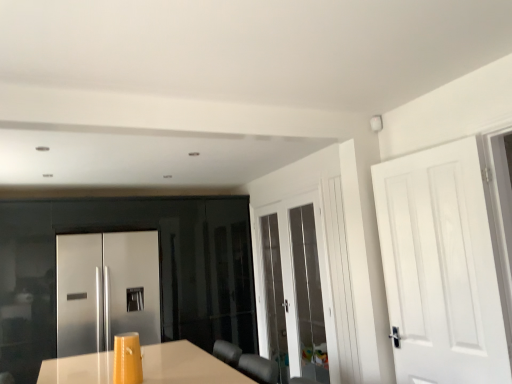
Question: Which is correct: white matte door at right, which is the third door from back to front, is inside satin stainless steel refrigerator at center, placed as the first door when sorted from back to front, or outside of it?

Choices:
 (A) inside
 (B) outside

Answer: (B)

Question: From the image's perspective, is white matte door at right, which is counted as the first door, starting from the right, located above or below satin stainless steel refrigerator at center, placed as the first door when sorted from back to front?

Choices:
 (A) below
 (B) above

Answer: (B)

Question: Which object is the farthest from the white matte door at right, acting as the 1th door starting from the front?

Choices:
 (A) satin stainless steel refrigerator at center, placed as the first door when sorted from back to front
 (B) white glossy door at center, the 2th door when ordered from right to left

Answer: (A)

Question: Which of these objects is positioned closest to the white glossy door at center, the second door from the front?

Choices:
 (A) satin stainless steel refrigerator at center, which ranks as the 1th door in left-to-right order
 (B) white matte door at right, acting as the 1th door starting from the front

Answer: (A)